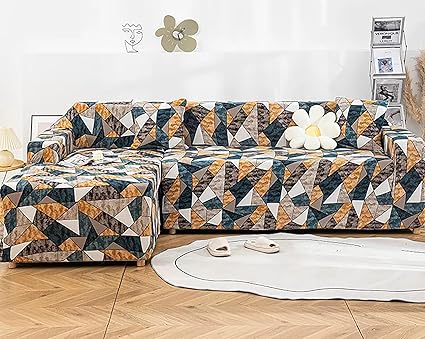
This screenshot has height=339, width=425. I want to click on artwork, so click(x=44, y=122), click(x=395, y=88), click(x=174, y=34), click(x=133, y=36).